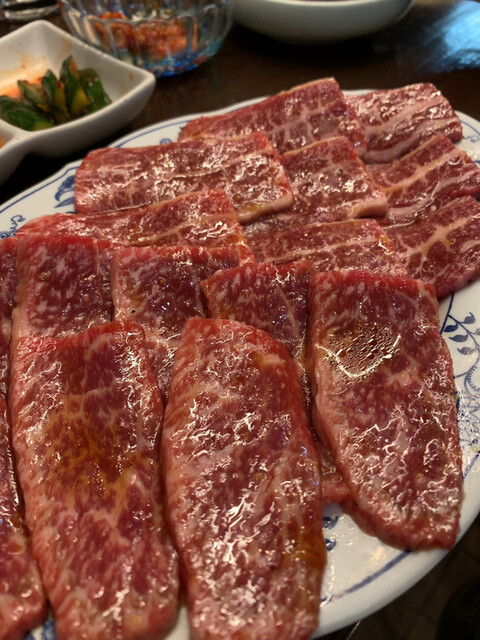
In order to click on table in this screenshot , I will do `click(243, 79)`.